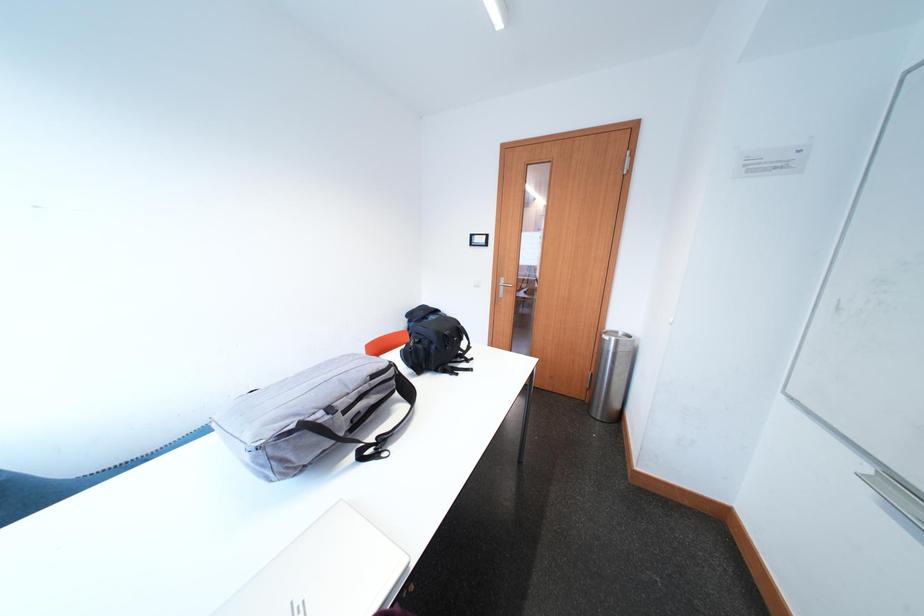
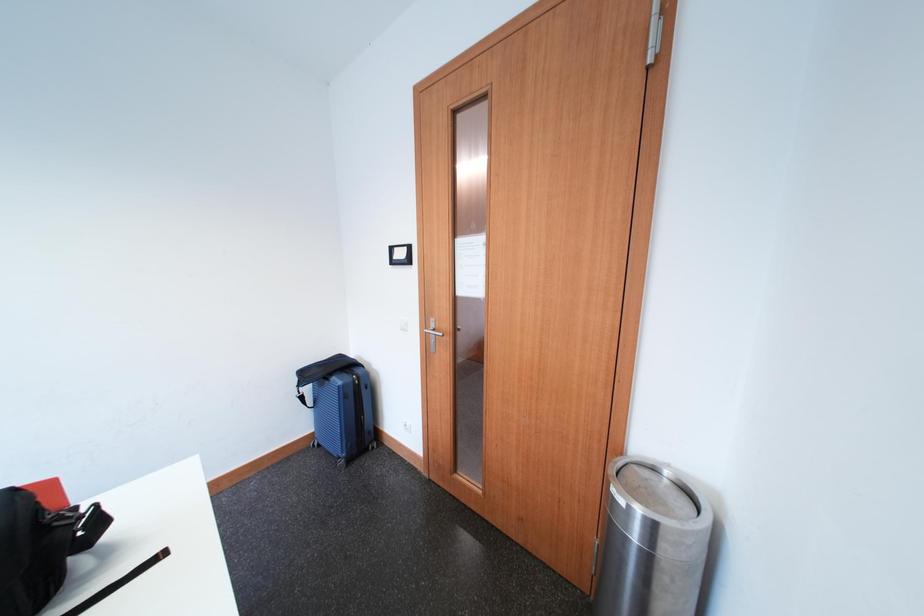
From the picture: What movement of the cameraman would produce the second image?

The cameraman moved toward right, forward.